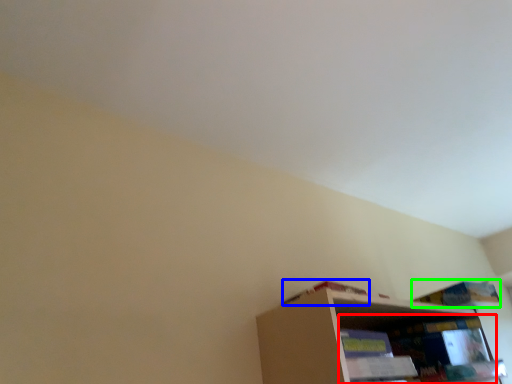
Question: Considering the real-world distances, which object is closest to shelf (highlighted by a red box)? book (highlighted by a blue box) or book (highlighted by a green box).

Choices:
 (A) book
 (B) book

Answer: (B)